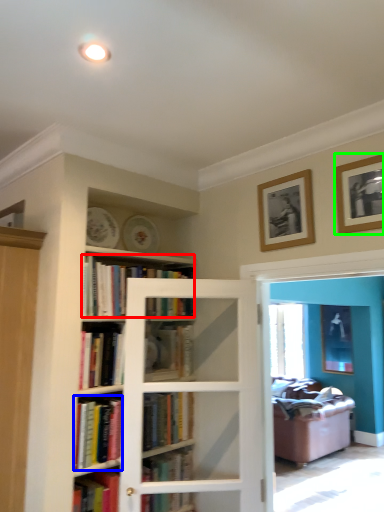
Question: Estimate the real-world distances between objects in this image. Which object is farther from book (highlighted by a red box), book (highlighted by a blue box) or picture frame (highlighted by a green box)?

Choices:
 (A) book
 (B) picture frame

Answer: (B)